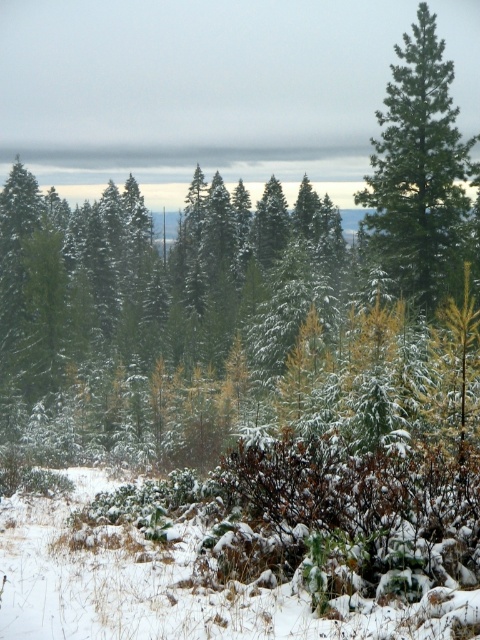
Is point (236, 596) less distant than point (383, 218)?

Yes, point (236, 596) is in front of point (383, 218).

Who is more distant from viewer, [179,556] or [441,264]?

The point [441,264] is more distant.

At what (x,y) coordinates should I click in order to perform the action: click on white fluffy snow at lower center. Please return your answer as a coordinate pair (x, y). This screenshot has height=640, width=480. Looking at the image, I should click on (169, 586).